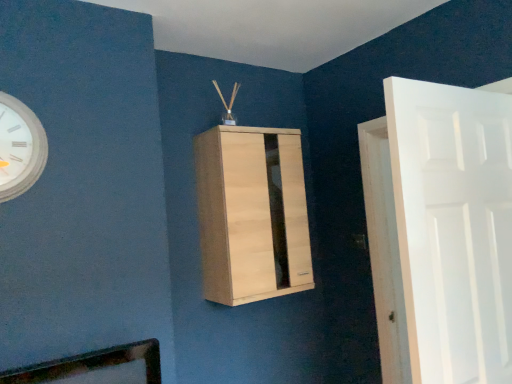
What is the approximate height of white matte door at right?

white matte door at right is 3.71 feet in height.

At what (x,y) coordinates should I click in order to perform the action: click on white matte clock at upper left. Please return your answer as a coordinate pair (x, y). The image size is (512, 384). Looking at the image, I should click on (19, 147).

Is light wood cabinet at center at the back of white matte clock at upper left?

white matte clock at upper left is not turned away from light wood cabinet at center.

Which of these two, white matte clock at upper left or light wood cabinet at center, is thinner?

white matte clock at upper left is thinner.

Which is behind, point (47, 148) or point (287, 239)?

The point (287, 239) is behind.

From a real-world perspective, relative to white matte clock at upper left, is white matte door at right vertically above or below?

In terms of real-world spatial position, white matte door at right is below white matte clock at upper left.

Between white matte door at right and white matte clock at upper left, which one has smaller width?

With smaller width is white matte clock at upper left.

Does point (468, 302) come behind point (38, 175)?

No.

Considering the relative sizes of white matte door at right and white matte clock at upper left in the image provided, is white matte door at right shorter than white matte clock at upper left?

Incorrect, the height of white matte door at right does not fall short of that of white matte clock at upper left.

Considering the relative sizes of white matte clock at upper left and white matte door at right in the image provided, is white matte clock at upper left wider than white matte door at right?

No.

Is white matte clock at upper left further to camera compared to white matte door at right?

Yes, the depth of white matte clock at upper left is greater than that of white matte door at right.

This screenshot has width=512, height=384. I want to click on wall clock positioned vertically above the white matte door at right (from a real-world perspective), so click(19, 147).

From the image's perspective, between white matte clock at upper left and white matte door at right, which one is located above?

white matte clock at upper left.

Does point (226, 302) appear closer or farther from the camera than point (492, 364)?

Clearly, point (226, 302) is more distant from the camera than point (492, 364).

Is light wood cabinet at center turned away from white matte door at right?

No, light wood cabinet at center is not facing away from white matte door at right.

Which of these two, light wood cabinet at center or white matte door at right, stands taller?

white matte door at right.

Is light wood cabinet at center further to the viewer compared to white matte door at right?

Yes, it is behind white matte door at right.

Does white matte door at right have a greater width compared to light wood cabinet at center?

No.

Is the depth of white matte door at right greater than that of light wood cabinet at center?

No, white matte door at right is closer to the viewer.

Based on their sizes in the image, would you say white matte door at right is bigger or smaller than light wood cabinet at center?

white matte door at right is smaller than light wood cabinet at center.

Does light wood cabinet at center come in front of white matte clock at upper left?

No, the depth of light wood cabinet at center is greater than that of white matte clock at upper left.

From the image's perspective, which is above, light wood cabinet at center or white matte clock at upper left?

white matte clock at upper left appears higher in the image.

Would you say light wood cabinet at center is inside or outside white matte clock at upper left?

light wood cabinet at center lies outside white matte clock at upper left.

Does light wood cabinet at center appear on the right side of white matte clock at upper left?

Yes.

Where is `wall clock positioned vertically above the light wood cabinet at center (from a real-world perspective)`? This screenshot has width=512, height=384. wall clock positioned vertically above the light wood cabinet at center (from a real-world perspective) is located at coordinates (19, 147).

Identify the location of door in front of the white matte clock at upper left. (453, 227).

Estimate the real-world distances between objects in this image. Which object is further from light wood cabinet at center, white matte door at right or white matte clock at upper left?

The object further to light wood cabinet at center is white matte clock at upper left.

Based on their spatial positions, is white matte clock at upper left or light wood cabinet at center further from white matte door at right?

white matte clock at upper left lies further to white matte door at right than the other object.

From the image, which object appears to be farther from white matte clock at upper left, white matte door at right or light wood cabinet at center?

white matte door at right lies further to white matte clock at upper left than the other object.

Considering their positions, is white matte clock at upper left positioned closer to light wood cabinet at center than white matte door at right?

white matte door at right lies closer to light wood cabinet at center than the other object.

Estimate the real-world distances between objects in this image. Which object is further from white matte door at right, light wood cabinet at center or white matte clock at upper left?

white matte clock at upper left.

Looking at the image, which one is located further to white matte clock at upper left, light wood cabinet at center or white matte door at right?

white matte door at right lies further to white matte clock at upper left than the other object.

This screenshot has height=384, width=512. In order to click on cupboard between white matte clock at upper left and white matte door at right from left to right in this screenshot , I will do tap(252, 213).